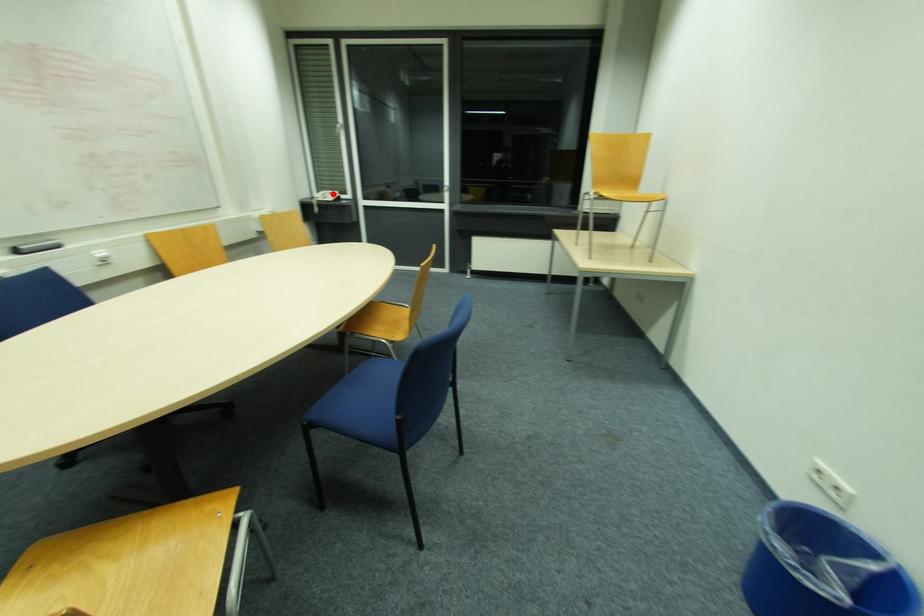
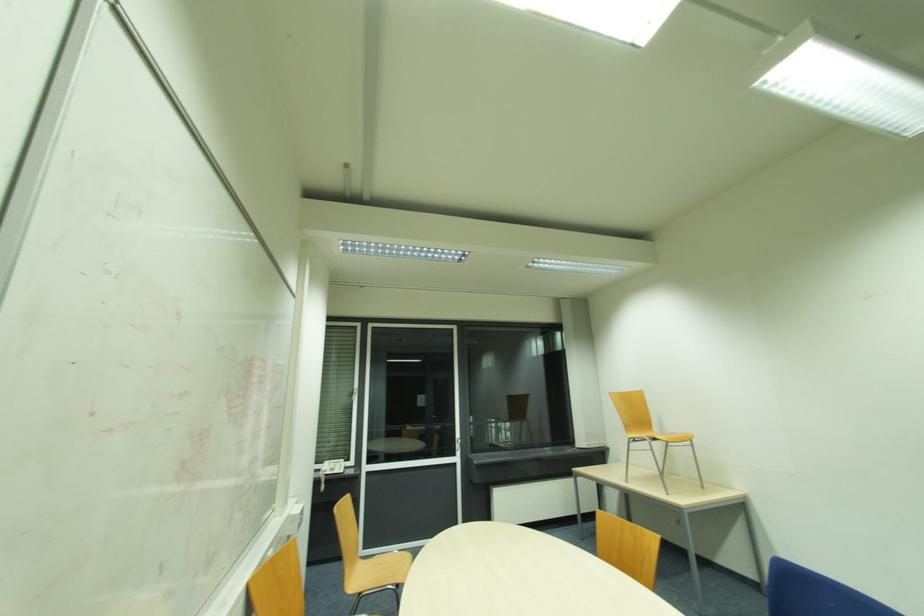
Question: I am providing you with two images of the same scene from different viewpoints. A red point is shown in image1. For the corresponding object point in image2, is it positioned nearer or farther from the camera?

Choices:
 (A) Nearer
 (B) Farther

Answer: (B)